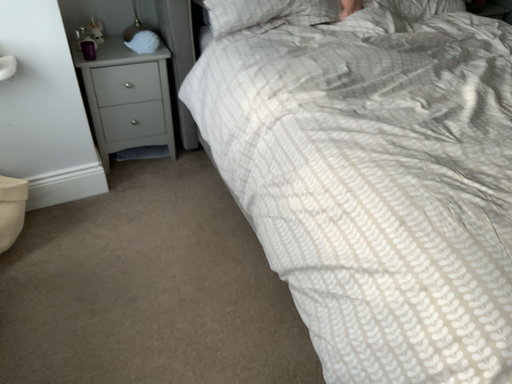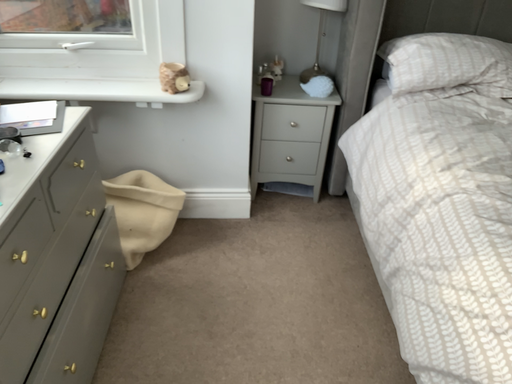
Question: How did the camera likely rotate when shooting the video?

Choices:
 (A) rotated downward
 (B) rotated upward

Answer: (B)